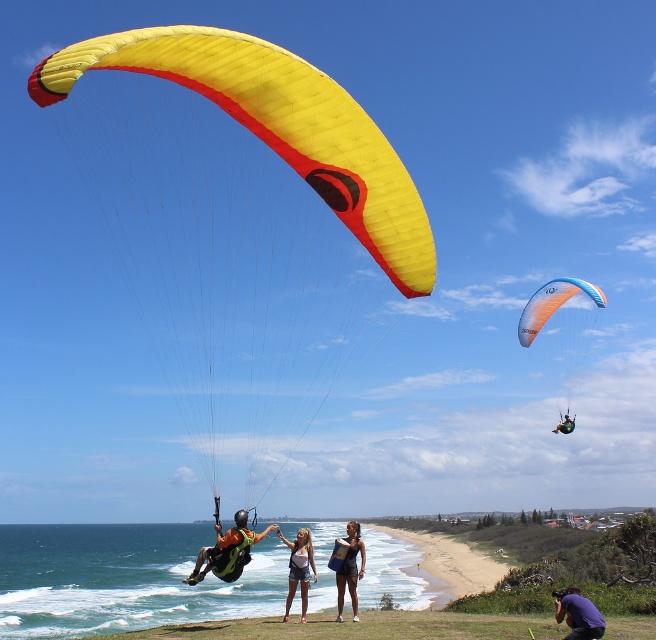
You are a photographer at the coastal location. You want to capture a photo where both the yellow matte parachute at center and the dark blue swimsuit at center are clearly visible. Which object should you focus on first to ensure both are in frame?

The yellow matte parachute at center is larger than the dark blue swimsuit at center, so you should focus on the yellow matte parachute at center first to ensure both are in frame.

You are standing at the edge of the cliff overlooking the beach and want to determine which of the two points, point (161, 74) or point (571, 636), is closer to you. Based on the scene, which point should you choose?

Point (161, 74) is closer to the viewer than point (571, 636), so you should choose point (161, 74).

You are a photographer standing at the coastal location. You want to capture a photo of the yellow matte parachute at center and the purple fabric camera at lower right. Which object should you focus on first if you want to include both in your frame without moving the camera?

You should focus on the yellow matte parachute at center first because it is positioned to the left of the purple fabric camera at lower right, so capturing it first ensures both objects are within the frame without needing to adjust the camera position.